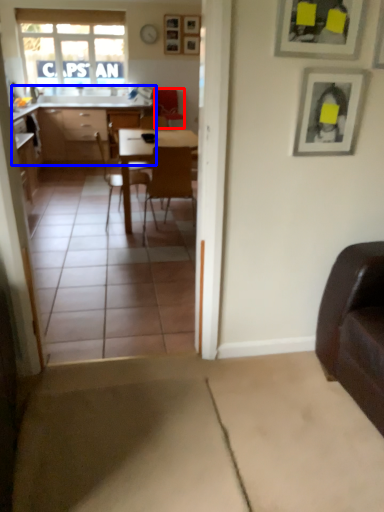
Question: Which point is further to the camera, armchair (highlighted by a red box) or cabinetry (highlighted by a blue box)?

Choices:
 (A) armchair
 (B) cabinetry

Answer: (A)